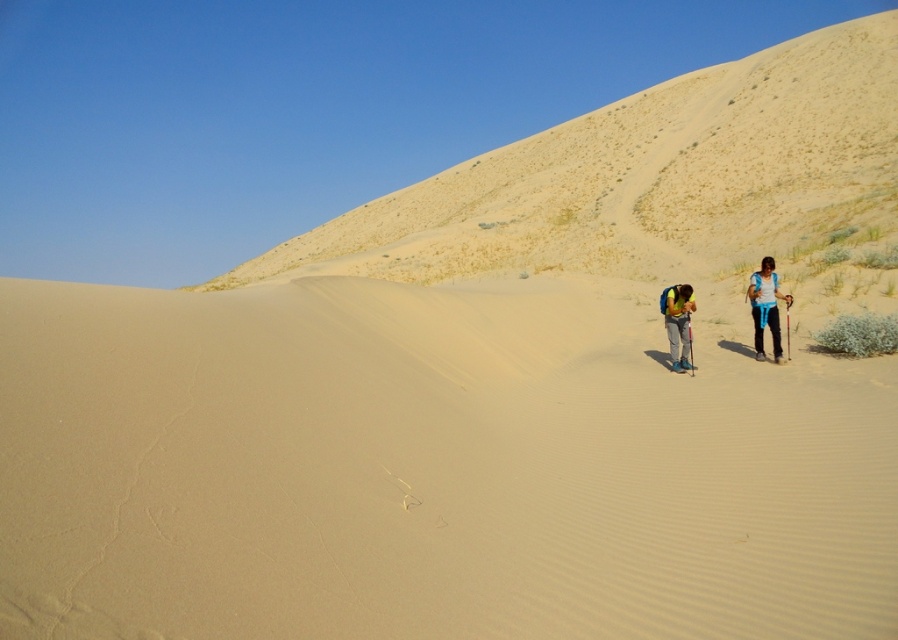
You are a hiker planning to cross the desert. You see the blue fabric backpack at right and the yellow backpack at center. Which backpack has a larger width?

The blue fabric backpack at right has a larger width than the yellow backpack at center.

You are one of the hikers and you want to place your yellow backpack at center on the smooth sand dune at upper center. Is this possible?

The smooth sand dune at upper center is further to the viewer than the yellow backpack at center, so the yellow backpack at center is closer to you. Therefore, you cannot place the yellow backpack at center on the smooth sand dune at upper center because it is behind you.

You are planning to hike across the desert and need to know which item is bigger between the smooth sand dune at center and the blue fabric backpack at right. Could you tell me which one is larger?

The smooth sand dune at center has a larger size compared to the blue fabric backpack at right, so the smooth sand dune at center is bigger.